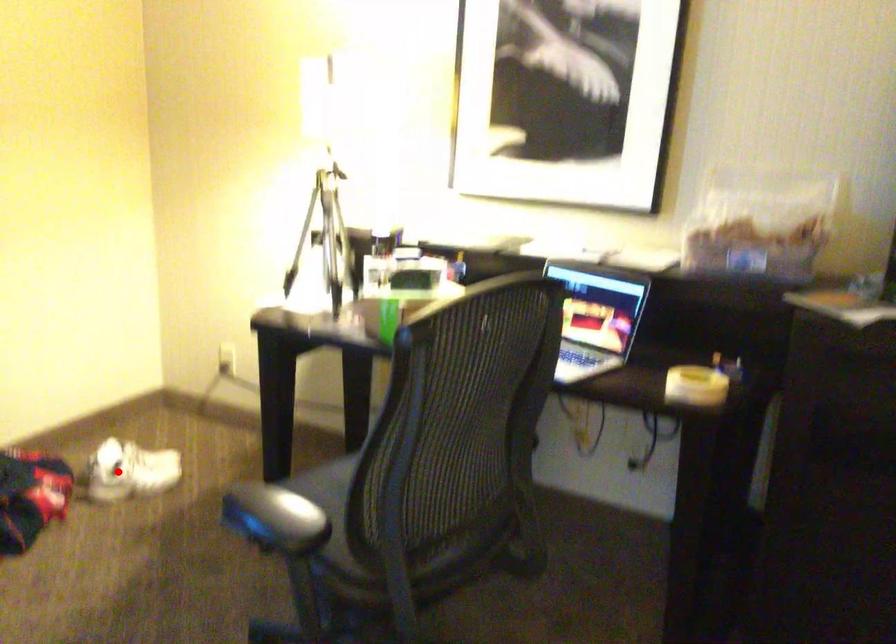
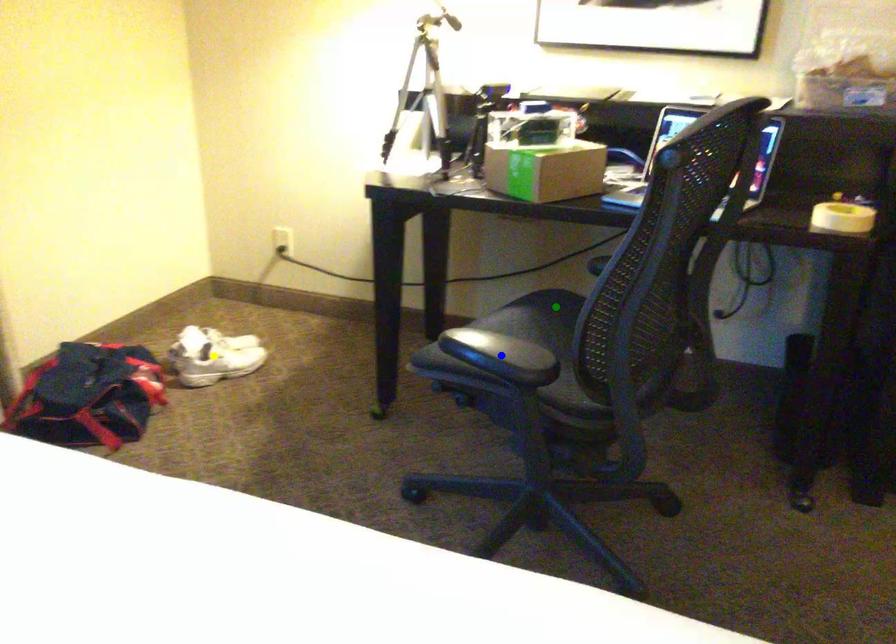
Question: I am providing you with two images of the same scene from different viewpoints. A red point is marked on the first image. You are given multiple points on the second image. Which point in image 2 is actually the same real-world point as the red point in image 1?

Choices:
 (A) green point
 (B) yellow point
 (C) blue point

Answer: (B)